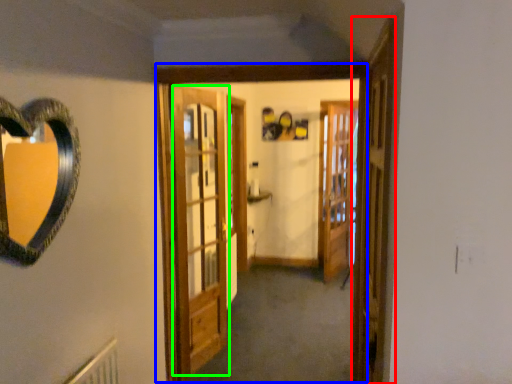
Question: Which object is positioned closest to screen door (highlighted by a red box)? Select from window frame (highlighted by a blue box) and barn door (highlighted by a green box).

Choices:
 (A) window frame
 (B) barn door

Answer: (A)